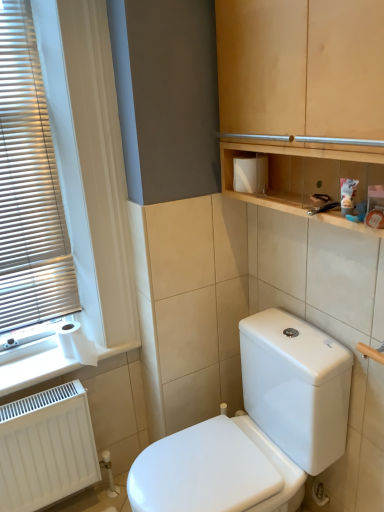
Question: From a real-world perspective, relative to white paper at lower left, is wooden cabinet at upper center vertically above or below?

Choices:
 (A) below
 (B) above

Answer: (B)

Question: Looking at their shapes, would you say wooden cabinet at upper center is wider or thinner than white paper at lower left?

Choices:
 (A) wide
 (B) thin

Answer: (B)

Question: Estimate the real-world distances between objects in this image. Which object is farther from the white plastic blinds at left?

Choices:
 (A) white matte radiator at lower left
 (B) white glossy toilet at center
 (C) white matte toiletry box at upper center
 (D) white matte toilet paper at lower left
 (E) wooden cabinet at upper center

Answer: (B)

Question: Considering the real-world distances, which object is farthest from the white paper at lower left?

Choices:
 (A) white matte radiator at lower left
 (B) wooden cabinet at upper center
 (C) white matte toilet paper at lower left
 (D) white matte toiletry box at upper center
 (E) white glossy toilet at center

Answer: (B)